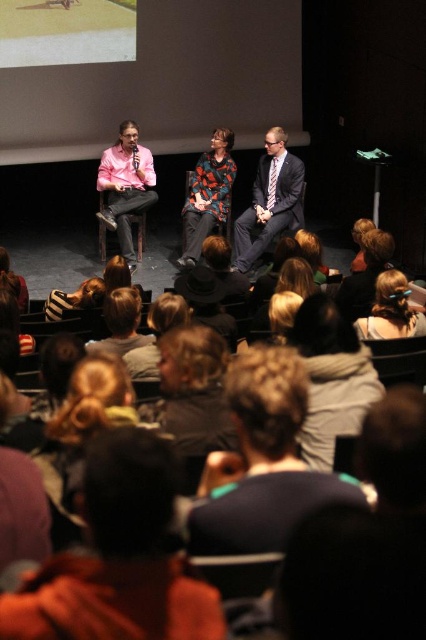
Question: Estimate the real-world distances between objects in this image. Which object is farther from the matte gray suit at center?

Choices:
 (A) brown hair at lower center
 (B) blonde hair at upper right
 (C) pink satin shirt at left
 (D) printed fabric jacket at center

Answer: (A)

Question: Estimate the real-world distances between objects in this image. Which object is farther from the printed fabric jacket at center?

Choices:
 (A) brown hair at lower center
 (B) matte gray suit at center

Answer: (A)

Question: Is brown hair at lower center to the left of matte gray suit at center from the viewer's perspective?

Choices:
 (A) no
 (B) yes

Answer: (B)

Question: Which point is farther to the camera?

Choices:
 (A) pink satin shirt at left
 (B) matte gray suit at center
 (C) blonde hair at center
 (D) brown hair at lower center

Answer: (A)

Question: From the image, what is the correct spatial relationship of blonde hair at center in relation to printed fabric jacket at center?

Choices:
 (A) left
 (B) right

Answer: (B)

Question: Is brown hair at lower center to the right of blonde hair at center from the viewer's perspective?

Choices:
 (A) no
 (B) yes

Answer: (A)